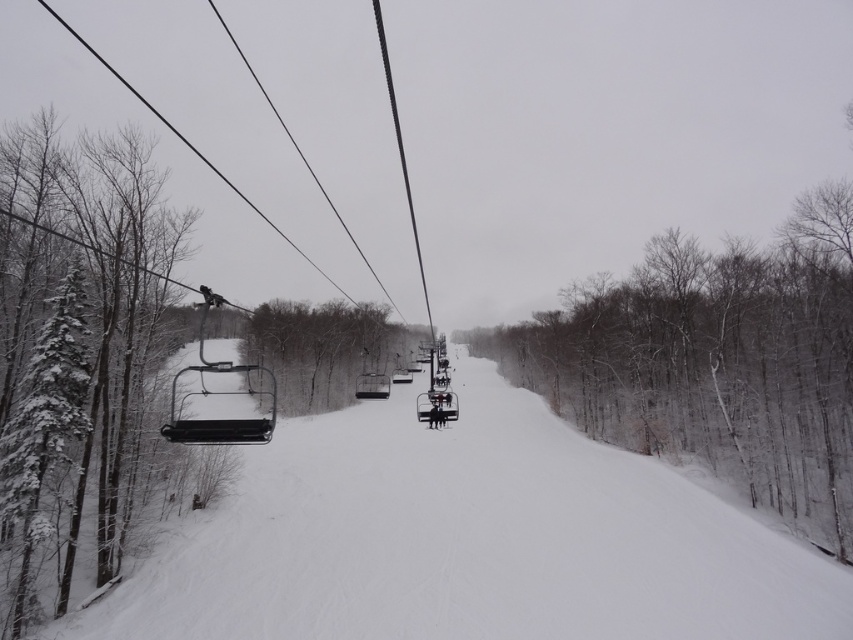
Question: Which point is closer to the camera?

Choices:
 (A) tap(611, 305)
 (B) tap(267, 346)
 (C) tap(422, 490)

Answer: (C)

Question: Which is farther from the snow-covered branches at center?

Choices:
 (A) white snow at center
 (B) snow-covered evergreen at left

Answer: (B)

Question: Is snowy bark trees at center bigger than snow-covered evergreen at left?

Choices:
 (A) yes
 (B) no

Answer: (A)

Question: Considering the real-world distances, which object is closest to the white snow at center?

Choices:
 (A) snow-covered evergreen at left
 (B) snowy bark trees at center
 (C) snow-covered evergreen tree at left
 (D) snow-covered branches at center

Answer: (C)

Question: Is snowy bark trees at center positioned in front of snow-covered evergreen at left?

Choices:
 (A) no
 (B) yes

Answer: (A)

Question: From the image, what is the correct spatial relationship of white snow at center in relation to snow-covered branches at center?

Choices:
 (A) left
 (B) right

Answer: (B)